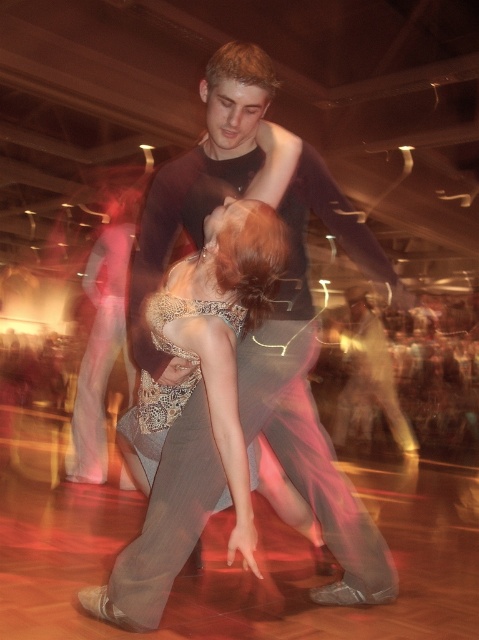
Question: Is satin silver dress at center positioned before satin lace dress at center?

Choices:
 (A) yes
 (B) no

Answer: (A)

Question: Which of the following is the closest to the observer?

Choices:
 (A) satin silver dress at center
 (B) satin lace dress at center
 (C) light gray pants at center

Answer: (A)

Question: Based on their relative distances, which object is nearer to the light gray pants at center?

Choices:
 (A) satin silver dress at center
 (B) dark gray suit at center

Answer: (B)

Question: Does dark gray suit at center have a lesser width compared to satin silver dress at center?

Choices:
 (A) yes
 (B) no

Answer: (B)

Question: Is the position of dark gray suit at center less distant than that of light gray pants at center?

Choices:
 (A) yes
 (B) no

Answer: (A)

Question: Which point appears closest to the camera in this image?

Choices:
 (A) (228, 193)
 (B) (150, 417)

Answer: (A)